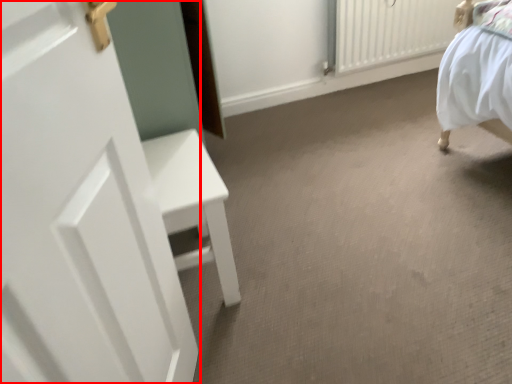
Question: From the image's perspective, considering the relative positions of door (annotated by the red box) and radiator in the image provided, where is door (annotated by the red box) located with respect to the staircase?

Choices:
 (A) above
 (B) below

Answer: (B)